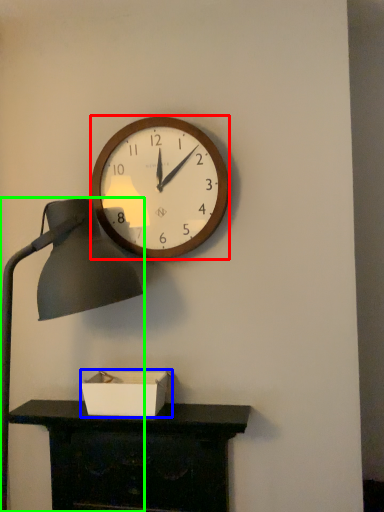
Question: Which object is positioned farthest from wall clock (highlighted by a red box)? Select from box (highlighted by a blue box) and lamp (highlighted by a green box).

Choices:
 (A) box
 (B) lamp

Answer: (A)